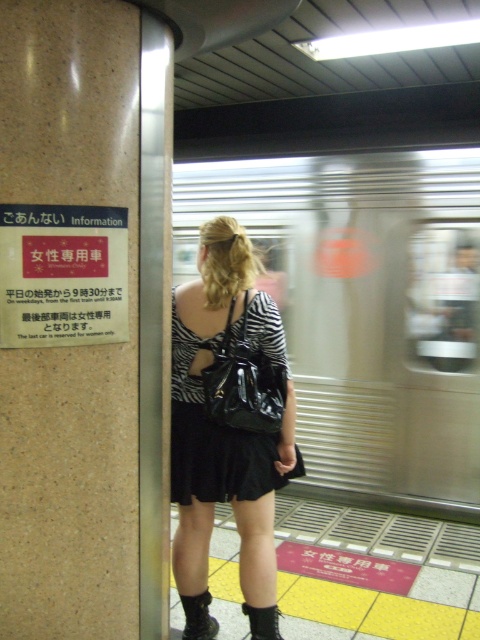
Please describe the location of the glossy black handbag at center in the subway station scene using coordinates. The scene has a coordinate system where the bottom left corner is the origin point. The X axis runs from left to right, and the Y axis runs from bottom to top. The coordinates are normalized between 0 and 1. Please provide the coordinates as a pair in parentheses with two decimal places, such as 0.50, 0.50. The answer must be concise and only include the coordinate pair in parentheses, without a

The glossy black handbag at center is located at coordinates approximately (244,384).

You are holding a 1.5 meter long pole and want to place it between the glossy black handbag at center and the pillar on the left. Will the pole fit between them?

The distance between the glossy black handbag at center and the pillar on the left is 2.08 meters. Since the pole is 1.5 meters long, it will fit between them with 0.58 meters of space remaining.

You are a delivery robot with a package that needs to be placed between the glossy black handbag at center and the black patent leather boot at lower center. The package requires a minimum of 3 feet of space to be safely placed. Can you fit it there?

The glossy black handbag at center is 36.68 inches away from the black patent leather boot at lower center. Since 36.68 inches is equal to 3.06 feet, the package requiring 3 feet of space can just barely fit between them.